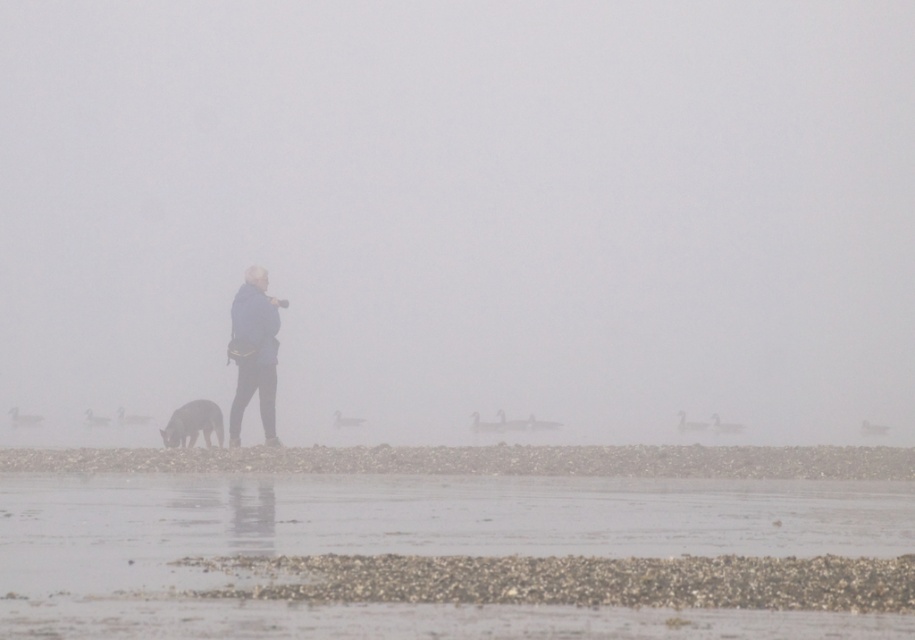
You are a photographer trying to capture the foggy coastal scene. You notice the blue fabric jacket at center and the shiny brown fur at lower left in your viewfinder. Which object should you focus on if you want to highlight the larger subject in your photo?

The blue fabric jacket at center is bigger than the shiny brown fur at lower left, so you should focus on the blue fabric jacket at center to highlight the larger subject in your photo.

You are trying to locate the blue fabric jacket at center in the foggy coastal scene. According to the coordinates provided, where would you look first?

You should look first at point 0.550 on the x axis and point 0.279 on the y axis, as that is where the blue fabric jacket at center is located.